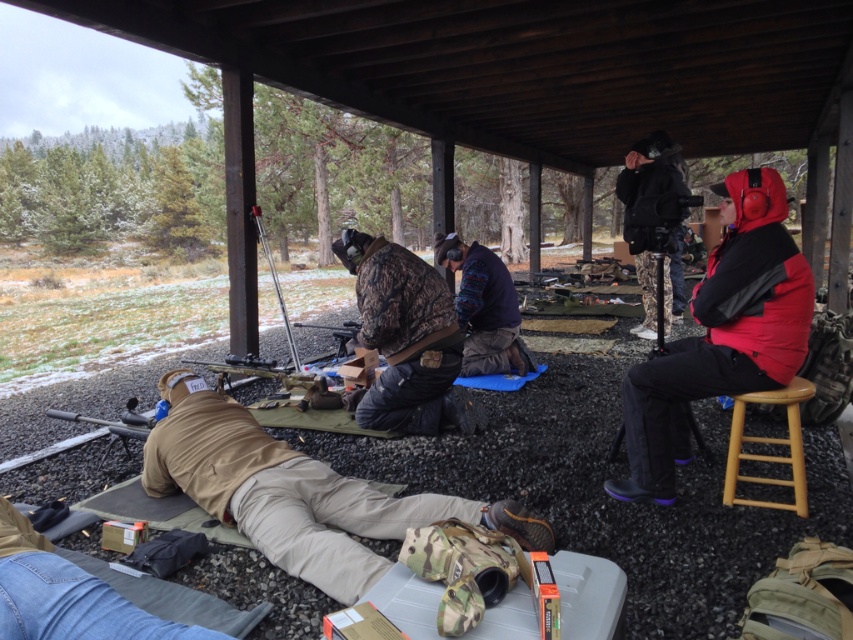
You are standing at the origin point of the coordinate system in the image. There is a red fleece jacket at right represented by point (721, 333). Where is the red fleece jacket located in relation to the origin?

The red fleece jacket at right is located at coordinates (721, 333) relative to the origin point.

You are organizing a winter clothing drive and need to determine which jacket can fit into a standard donation box that is 30 inches wide. Based on the image, which jacket between the red fleece jacket at right and the camouflage fabric jacket at center is wider?

The red fleece jacket at right is wider than the camouflage fabric jacket at center, so it would not fit into the 30 inches wide donation box. The camouflage fabric jacket at center is narrower and would fit better.

You are organizing a clothing donation drive and need to know which item takes up more space when folded. Based on the image, which of the two items, the knitted sweater at center or the black matte jacket at upper right, is wider?

The black matte jacket at upper right is wider than the knitted sweater at center, so it takes up more space when folded.